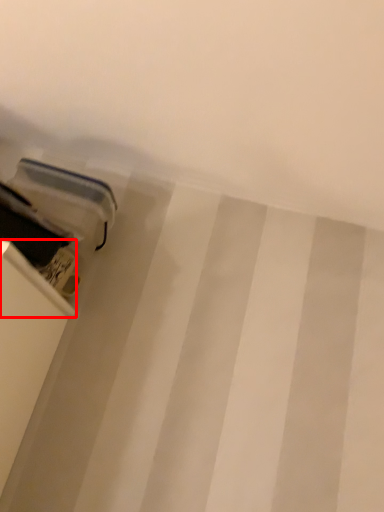
Question: From the image's perspective, considering the relative positions of shelf (annotated by the red box) and equipment in the image provided, where is shelf (annotated by the red box) located with respect to the staircase?

Choices:
 (A) below
 (B) above

Answer: (A)